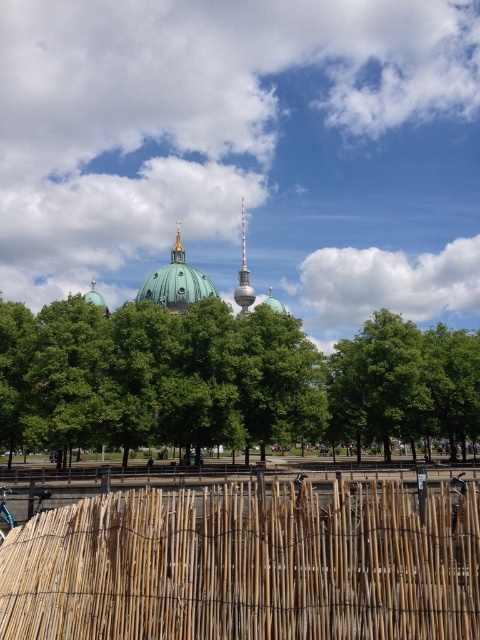
Between point (60, 371) and point (180, 250), which one is positioned in front?

Point (60, 371) is in front.

In the scene shown: Can you confirm if green leafy tree at center is taller than gold plated spire at center?

Correct, green leafy tree at center is much taller as gold plated spire at center.

This screenshot has width=480, height=640. I want to click on green leafy tree at center, so click(x=226, y=378).

Does bamboo mat at center appear on the right side of green matte dome at center?

Indeed, bamboo mat at center is positioned on the right side of green matte dome at center.

In the scene shown: Is bamboo mat at center taller than green matte dome at center?

No, bamboo mat at center is not taller than green matte dome at center.

This screenshot has width=480, height=640. What are the coordinates of `bamboo mat at center` in the screenshot? It's located at click(247, 564).

From the picture: Is bamboo mat at center taller than green leafy tree at center?

No.

What do you see at coordinates (247, 564) in the screenshot?
I see `bamboo mat at center` at bounding box center [247, 564].

I want to click on bamboo mat at center, so click(x=247, y=564).